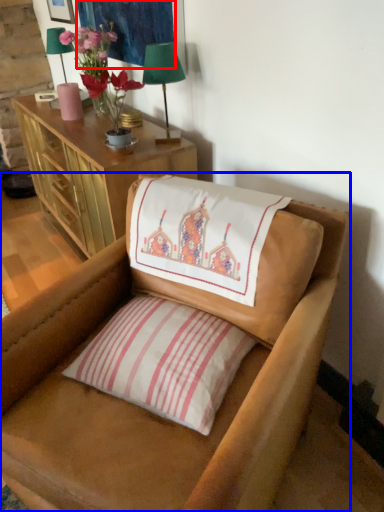
Question: Which point is further to the camera, tapestry (highlighted by a red box) or chair (highlighted by a blue box)?

Choices:
 (A) tapestry
 (B) chair

Answer: (A)